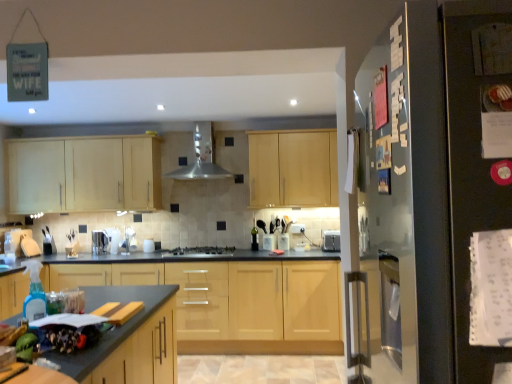
Question: In which direction should I rotate to look at light wood cabinet at center, marked as the 3th cabinetry in a top-to-bottom arrangement?

Choices:
 (A) right
 (B) left

Answer: (B)

Question: Is satin silver exhaust hood at center at the back of satin silver toaster at center, which ranks as the 1th appliance in left-to-right order?

Choices:
 (A) yes
 (B) no

Answer: (B)

Question: Would you consider satin silver toaster at center, which is the 2th appliance in right-to-left order, to be distant from satin silver exhaust hood at center?

Choices:
 (A) no
 (B) yes

Answer: (B)

Question: Considering the relative sizes of satin silver toaster at center, which is the 2th appliance in right-to-left order, and satin silver exhaust hood at center in the image provided, is satin silver toaster at center, which is the 2th appliance in right-to-left order, thinner than satin silver exhaust hood at center?

Choices:
 (A) yes
 (B) no

Answer: (A)

Question: From a real-world perspective, is satin silver toaster at center, which is the 2th appliance in right-to-left order, on top of satin silver exhaust hood at center?

Choices:
 (A) no
 (B) yes

Answer: (A)

Question: Considering the relative sizes of satin silver toaster at center, which is the 2th appliance in right-to-left order, and satin silver exhaust hood at center in the image provided, is satin silver toaster at center, which is the 2th appliance in right-to-left order, shorter than satin silver exhaust hood at center?

Choices:
 (A) no
 (B) yes

Answer: (B)

Question: Is satin silver toaster at center, which ranks as the 1th appliance in left-to-right order, behind satin silver exhaust hood at center?

Choices:
 (A) no
 (B) yes

Answer: (B)

Question: Does black matte refrigerator at right touch granite gray countertop at lower left?

Choices:
 (A) no
 (B) yes

Answer: (A)

Question: Can you confirm if black matte refrigerator at right is shorter than granite gray countertop at lower left?

Choices:
 (A) yes
 (B) no

Answer: (B)

Question: Does black matte refrigerator at right turn towards granite gray countertop at lower left?

Choices:
 (A) no
 (B) yes

Answer: (A)

Question: From a real-world perspective, is black matte refrigerator at right on top of granite gray countertop at lower left?

Choices:
 (A) no
 (B) yes

Answer: (B)

Question: Does black matte refrigerator at right appear on the right side of granite gray countertop at lower left?

Choices:
 (A) yes
 (B) no

Answer: (A)

Question: Is the depth of black matte refrigerator at right greater than that of granite gray countertop at lower left?

Choices:
 (A) no
 (B) yes

Answer: (A)

Question: From a real-world perspective, is granite gray countertop at lower left physically above light wood cabinet at center, marked as the 3th cabinetry in a top-to-bottom arrangement?

Choices:
 (A) yes
 (B) no

Answer: (A)